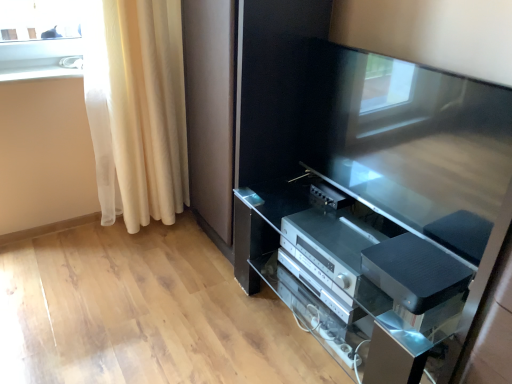
Question: Relative to white sheer curtain at left, is satin black tv cabinet at center in front or behind?

Choices:
 (A) behind
 (B) front

Answer: (B)

Question: Considering the positions of point (372, 284) and point (145, 62), is point (372, 284) closer or farther from the camera than point (145, 62)?

Choices:
 (A) closer
 (B) farther

Answer: (A)

Question: Estimate the real-world distances between objects in this image. Which object is closer to the silver metallic stereo at lower center, the first appliance viewed from the back?

Choices:
 (A) white glossy window sill at upper left
 (B) satin black tv cabinet at center
 (C) satin black tv at center
 (D) black textured speaker at lower right, the 1th appliance when ordered from front to back
 (E) white sheer curtain at left

Answer: (B)

Question: Which of these objects is positioned closest to the satin black tv cabinet at center?

Choices:
 (A) black textured speaker at lower right, placed as the second appliance when sorted from back to front
 (B) satin black tv at center
 (C) silver metallic stereo at lower center, the first appliance viewed from the back
 (D) white sheer curtain at left
 (E) white glossy window sill at upper left

Answer: (C)